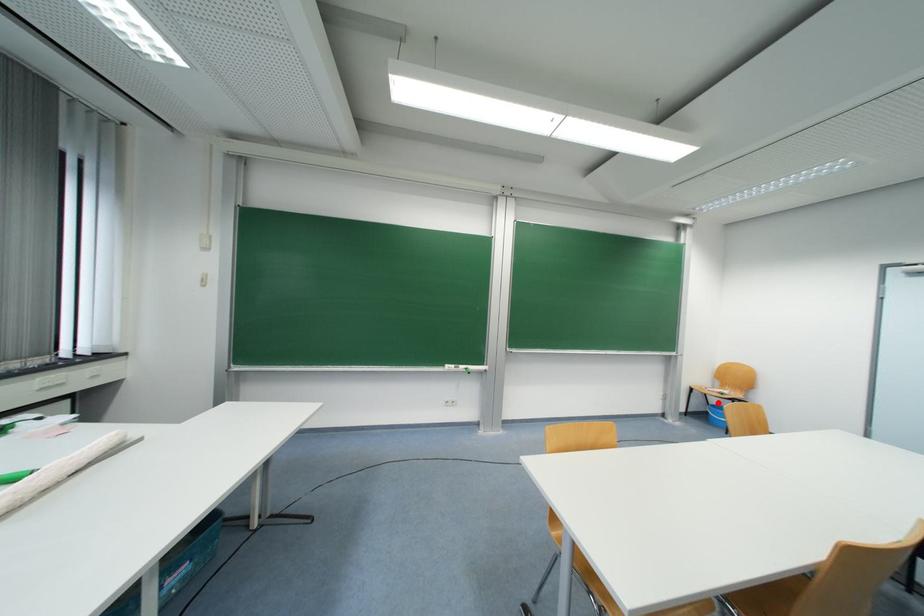
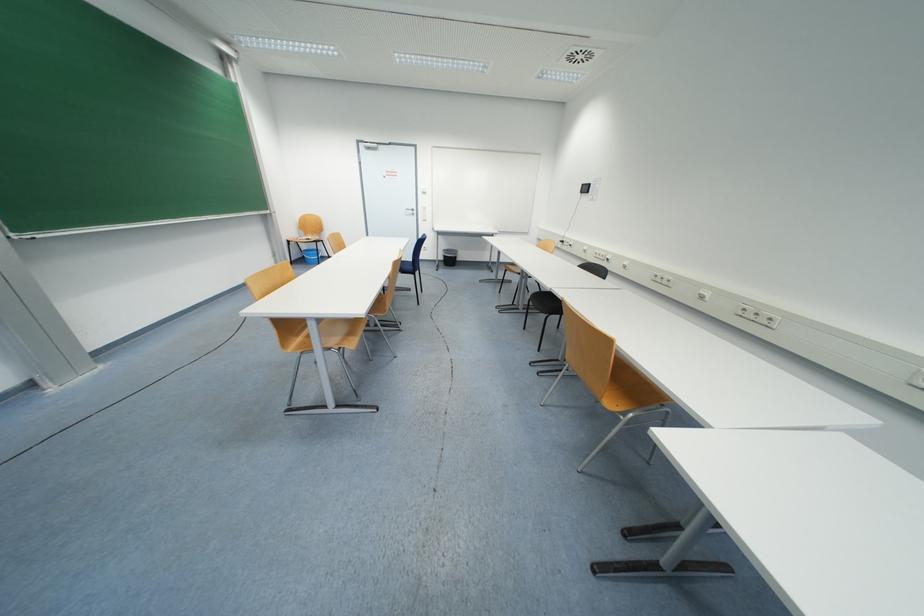
In the second image, find the point that corresponds to the highlighted location in the first image.

(309, 249)